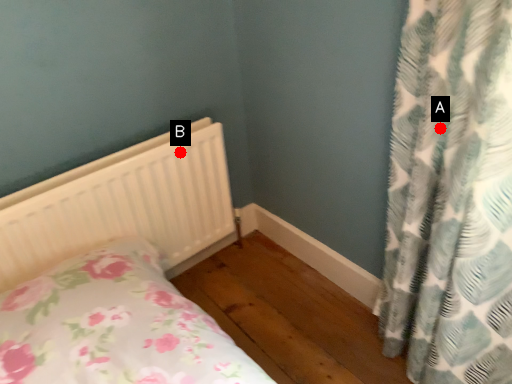
Question: Two points are circled on the image, labeled by A and B beside each circle. Which of the following is the closest to the observer?

Choices:
 (A) A is closer
 (B) B is closer

Answer: (A)